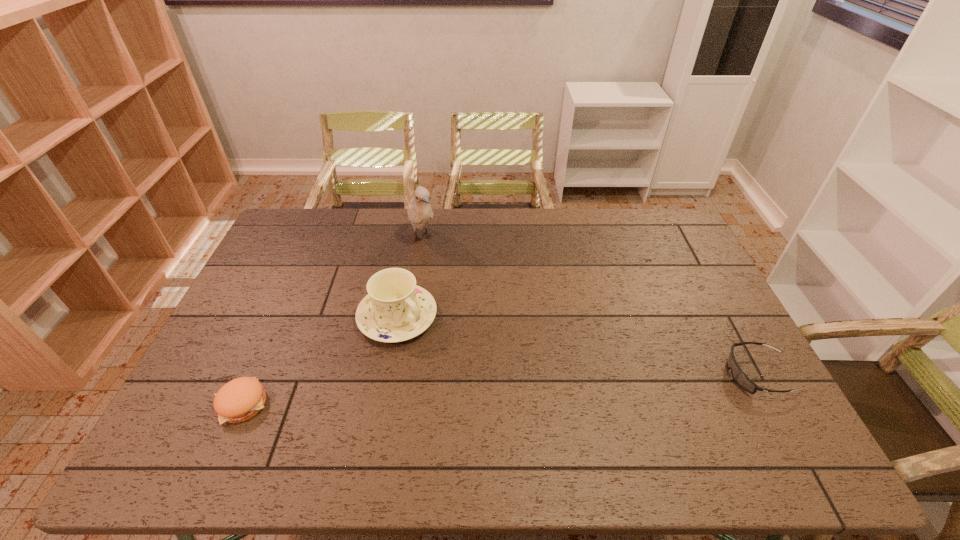
I want to click on the leftmost object, so click(x=240, y=399).

Locate an element on the screen. Image resolution: width=960 pixels, height=540 pixels. goggles is located at coordinates (741, 379).

In order to click on bird in this screenshot , I will do `click(420, 213)`.

You are a GUI agent. You are given a task and a screenshot of the screen. Output one action in this format:
    pyautogui.click(x=<x>, y=<y>)
    Task: Click on the farthest object
    
    Given the screenshot: What is the action you would take?
    pyautogui.click(x=420, y=213)

This screenshot has height=540, width=960. Find the location of `the second tallest object`. the second tallest object is located at coordinates (396, 309).

Find the location of a particular element. Image resolution: width=960 pixels, height=540 pixels. the second farthest object is located at coordinates (396, 309).

Identify the location of free space located 0.140m on the back of the leftmost object. (270, 340).

Find the location of `free space located 0.140m on the lenses of the goggles`. free space located 0.140m on the lenses of the goggles is located at coordinates (674, 374).

At what (x,y) coordinates should I click in order to perform the action: click on free space located 0.220m on the lenses of the goggles. Please return your answer as a coordinate pair (x, y). The width and height of the screenshot is (960, 540). Looking at the image, I should click on pyautogui.click(x=644, y=374).

What are the coordinates of `vacant area situated on the lenses of the goggles` in the screenshot? It's located at pos(608,374).